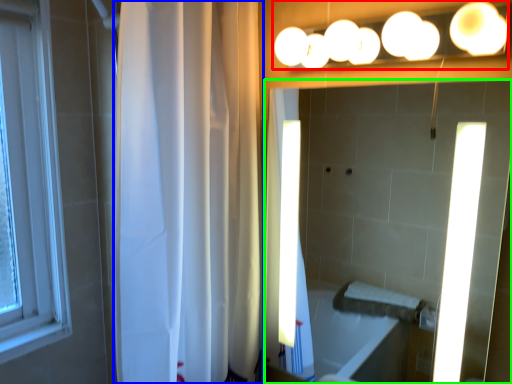
Question: Which object is the closest to the fixture (highlighted by a red box)? Choose among these: shower curtain (highlighted by a blue box) or mirror (highlighted by a green box).

Choices:
 (A) shower curtain
 (B) mirror

Answer: (A)